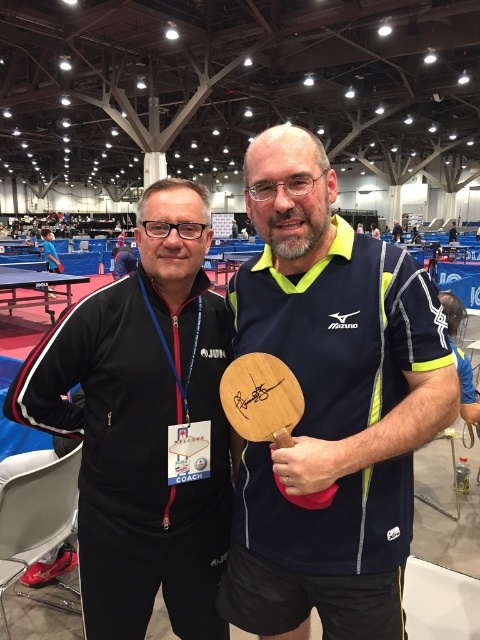
From the picture: Is the position of wooden paddle at center less distant than that of black matte jacket at center?

Yes, wooden paddle at center is closer to the viewer.

Does wooden paddle at center have a lesser height compared to black matte jacket at center?

Yes.

Is point (396, 419) positioned behind point (158, 481)?

No, (396, 419) is closer to viewer.

The height and width of the screenshot is (640, 480). I want to click on wooden paddle at center, so click(330, 406).